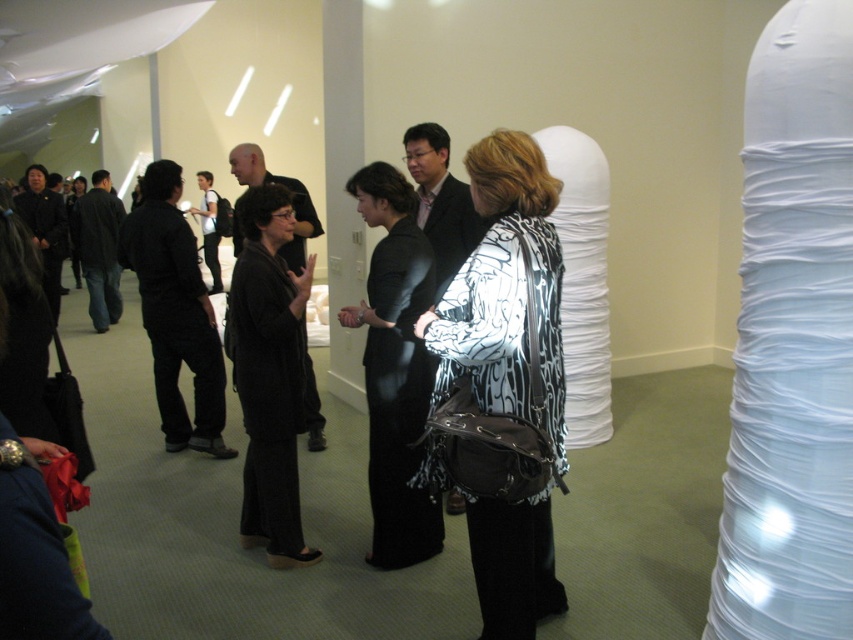
You are an event planner arranging seating for a small discussion panel. You need to seat two guests who are wearing the printed fabric jacket at center and the black silk dress at center. The chairs provided are standard width. Can both guests comfortably sit in their respective chairs without adjusting their clothing?

The printed fabric jacket at center might be wider than black silk dress at center, so there is a possibility that the guest wearing the printed fabric jacket at center may need a wider chair to accommodate the jacket comfortably. However, since the comparison is uncertain, it is advisable to provide chairs with adjustable or slightly wider seats to ensure comfort for both guests.

You are a photographer at the event and need to capture both the printed fabric jacket at center and the black silk dress at center in a single frame. Which clothing item will appear shorter in the photo?

The printed fabric jacket at center will appear shorter in the photo because it is not as tall as the black silk dress at center.

Based on the photo, you are an event planner organizing a photoshoot in the gallery. You need to position a camera at the center of the room. The printed fabric jacket at center is currently blocking the spot. Can you move it to the right side of the room without moving any other objects?

The printed fabric jacket at center is located at point (502, 387), which is near the center. Moving it to the right side would require shifting it horizontally to a position with a higher x coordinate. Since there are no other objects mentioned in the scene, it is possible to move the jacket to the right side without disturbing other items.